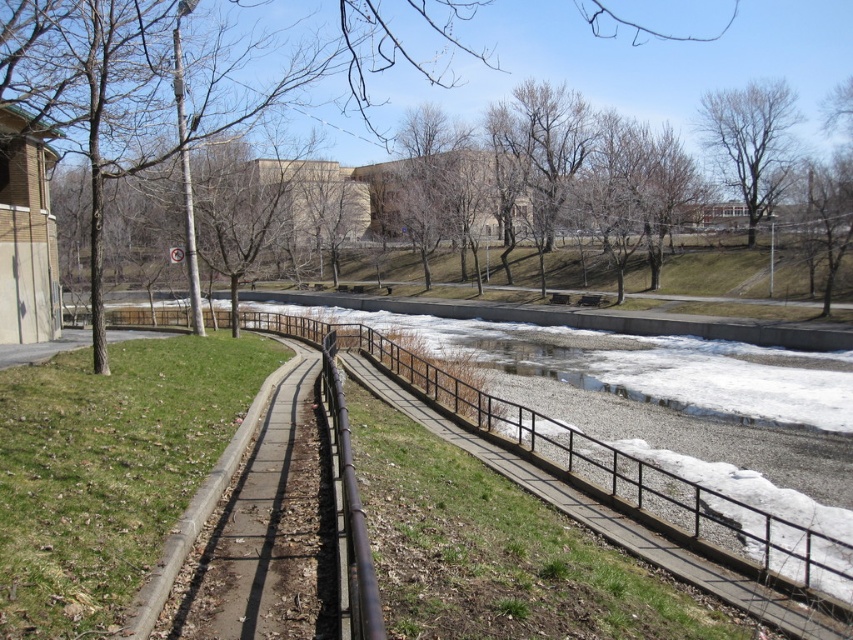
Who is more forward, (730, 600) or (329, 436)?

Point (730, 600) is in front.

Locate an element on the screen. black metal rail at center is located at coordinates (614, 515).

At what (x,y) coordinates should I click in order to perform the action: click on black metal rail at center. Please return your answer as a coordinate pair (x, y). The width and height of the screenshot is (853, 640). Looking at the image, I should click on (614, 515).

Does bare branches at upper center appear over brown metal rail at center?

Yes, bare branches at upper center is above brown metal rail at center.

From the picture: Who is positioned more to the left, bare branches at upper center or brown metal rail at center?

brown metal rail at center is more to the left.

You are a GUI agent. You are given a task and a screenshot of the screen. Output one action in this format:
    pyautogui.click(x=<x>, y=<y>)
    Task: Click on the bare branches at upper center
    The height and width of the screenshot is (640, 853).
    Given the screenshot: What is the action you would take?
    pyautogui.click(x=751, y=141)

This screenshot has width=853, height=640. I want to click on bare branches at upper center, so click(x=751, y=141).

What do you see at coordinates (192, 77) in the screenshot?
I see `brown leafless tree at upper center` at bounding box center [192, 77].

Consider the image. Is brown leafless tree at upper center bigger than brown metal rail at center?

Yes.

Who is more distant from viewer, (430, 65) or (329, 349)?

The point (430, 65) is more distant.

Where is `brown leafless tree at upper center`? Image resolution: width=853 pixels, height=640 pixels. brown leafless tree at upper center is located at coordinates (192, 77).